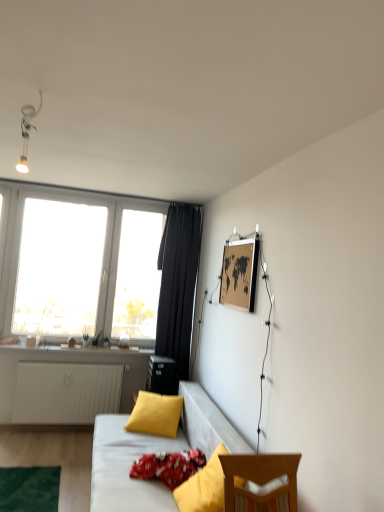
Describe the element at coordinates (153, 452) in the screenshot. This screenshot has height=512, width=384. I see `soft white fabric couch at center` at that location.

Measure the distance between wooden map at upper right and camera.

wooden map at upper right is 9.53 feet from camera.

This screenshot has width=384, height=512. Describe the element at coordinates (178, 284) in the screenshot. I see `black fabric curtain at center` at that location.

Describe the element at coordinates (204, 487) in the screenshot. The width and height of the screenshot is (384, 512). I see `yellow fabric pillow at lower right, which is the 3th pillow in back-to-front order` at that location.

Image resolution: width=384 pixels, height=512 pixels. I want to click on yellow fabric pillow at lower right, which is the 3th pillow in back-to-front order, so click(x=204, y=487).

Locate an element on the screen. The height and width of the screenshot is (512, 384). red cotton pillow at lower center, arranged as the second pillow when viewed from the back is located at coordinates (168, 466).

Where is `matte white light fixture at upper left`? The width and height of the screenshot is (384, 512). matte white light fixture at upper left is located at coordinates (27, 132).

From the picture: In order to face matte white light fixture at upper left, should I rotate leftwards or rightwards?

It's best to rotate left around 21.346 degrees.

Locate an element on the screen. The height and width of the screenshot is (512, 384). soft white fabric couch at center is located at coordinates pos(153,452).

Is matte white light fixture at upper left completely or partially inside red cotton pillow at lower center, arranged as the second pillow when viewed from the back?

No, matte white light fixture at upper left is not inside red cotton pillow at lower center, arranged as the second pillow when viewed from the back.

Could you tell me if red cotton pillow at lower center, marked as the second pillow in a front-to-back arrangement, is turned towards matte white light fixture at upper left?

No, red cotton pillow at lower center, marked as the second pillow in a front-to-back arrangement, is not turned towards matte white light fixture at upper left.

Consider the image. Between red cotton pillow at lower center, arranged as the second pillow when viewed from the back, and matte white light fixture at upper left, which one has larger size?

red cotton pillow at lower center, arranged as the second pillow when viewed from the back.

Does yellow matte pillow at center, which appears as the first pillow when viewed from the back, have a smaller size compared to yellow fabric pillow at lower right, which is the 3th pillow in back-to-front order?

Correct, yellow matte pillow at center, which appears as the first pillow when viewed from the back, occupies less space than yellow fabric pillow at lower right, which is the 3th pillow in back-to-front order.

From a real-world perspective, is yellow matte pillow at center, the 3th pillow positioned from the front, physically above yellow fabric pillow at lower right, marked as the first pillow in a front-to-back arrangement?

Incorrect, from a real-world perspective, yellow matte pillow at center, the 3th pillow positioned from the front, is lower than yellow fabric pillow at lower right, marked as the first pillow in a front-to-back arrangement.

Consider the image. From the image's perspective, is yellow matte pillow at center, the 3th pillow positioned from the front, above or below yellow fabric pillow at lower right, marked as the first pillow in a front-to-back arrangement?

Clearly, from the image's perspective, yellow matte pillow at center, the 3th pillow positioned from the front, is below yellow fabric pillow at lower right, marked as the first pillow in a front-to-back arrangement.

Who is taller, yellow matte pillow at center, the 3th pillow positioned from the front, or yellow fabric pillow at lower right, which is the 3th pillow in back-to-front order?

Standing taller between the two is yellow fabric pillow at lower right, which is the 3th pillow in back-to-front order.

Considering the positions of point (191, 312) and point (150, 463), is point (191, 312) closer or farther from the camera than point (150, 463)?

Point (191, 312) is farther from the camera than point (150, 463).

From a real-world perspective, which object rests below the other?

red cotton pillow at lower center, arranged as the second pillow when viewed from the back, is physically lower.

From the image's perspective, who appears lower, black fabric curtain at center or red cotton pillow at lower center, arranged as the second pillow when viewed from the back?

A: red cotton pillow at lower center, arranged as the second pillow when viewed from the back, from the image's perspective.

Can you confirm if black fabric curtain at center is positioned to the right of red cotton pillow at lower center, arranged as the second pillow when viewed from the back?

Yes, black fabric curtain at center is to the right of red cotton pillow at lower center, arranged as the second pillow when viewed from the back.

Is wooden map at upper right in front of or behind transparent glass window at upper left in the image?

In the image, wooden map at upper right appears in front of transparent glass window at upper left.

Is wooden map at upper right facing away from transparent glass window at upper left?

No, wooden map at upper right is not facing away from transparent glass window at upper left.

Is wooden map at upper right in contact with transparent glass window at upper left?

wooden map at upper right and transparent glass window at upper left are clearly separated.

From the image's perspective, which is above, wooden map at upper right or transparent glass window at upper left?

wooden map at upper right appears higher in the image.

Considering the relative sizes of black fabric curtain at center and soft white fabric couch at center in the image provided, is black fabric curtain at center taller than soft white fabric couch at center?

Indeed, black fabric curtain at center has a greater height compared to soft white fabric couch at center.

Find the location of `studio couch located underneath the black fabric curtain at center (from a real-world perspective)`. studio couch located underneath the black fabric curtain at center (from a real-world perspective) is located at coordinates (153, 452).

Which is behind, point (171, 234) or point (93, 502)?

Positioned behind is point (171, 234).

Is black fabric curtain at center next to soft white fabric couch at center?

black fabric curtain at center and soft white fabric couch at center are not in contact.

Based on the photo, is yellow matte pillow at center, the 3th pillow positioned from the front, outside of matte white light fixture at upper left?

yellow matte pillow at center, the 3th pillow positioned from the front, lies outside matte white light fixture at upper left's area.

Considering the positions of point (166, 424) and point (26, 161), is point (166, 424) closer or farther from the camera than point (26, 161)?

Point (166, 424) is farther from the camera than point (26, 161).

In the scene shown: Who is shorter, yellow matte pillow at center, the 3th pillow positioned from the front, or matte white light fixture at upper left?

With less height is yellow matte pillow at center, the 3th pillow positioned from the front.

Does red cotton pillow at lower center, arranged as the second pillow when viewed from the back, have a greater height compared to yellow fabric pillow at lower right, marked as the first pillow in a front-to-back arrangement?

No, red cotton pillow at lower center, arranged as the second pillow when viewed from the back, is not taller than yellow fabric pillow at lower right, marked as the first pillow in a front-to-back arrangement.

Is red cotton pillow at lower center, marked as the second pillow in a front-to-back arrangement, completely or partially outside of yellow fabric pillow at lower right, which is the 3th pillow in back-to-front order?

Yes, red cotton pillow at lower center, marked as the second pillow in a front-to-back arrangement, is located beyond the bounds of yellow fabric pillow at lower right, which is the 3th pillow in back-to-front order.

In terms of width, does red cotton pillow at lower center, arranged as the second pillow when viewed from the back, look wider or thinner when compared to yellow fabric pillow at lower right, which is the 3th pillow in back-to-front order?

Considering their sizes, red cotton pillow at lower center, arranged as the second pillow when viewed from the back, looks broader than yellow fabric pillow at lower right, which is the 3th pillow in back-to-front order.

How many degrees apart are the facing directions of red cotton pillow at lower center, arranged as the second pillow when viewed from the back, and yellow fabric pillow at lower right, marked as the first pillow in a front-to-back arrangement?

They differ by 2.17 degrees in their facing directions.

Locate an element on the screen. This screenshot has height=512, width=384. pillow that is the 2nd one when counting backward from the matte white light fixture at upper left is located at coordinates (168, 466).

Where is `the 2nd pillow in front when counting from the yellow matte pillow at center, which appears as the first pillow when viewed from the back`? the 2nd pillow in front when counting from the yellow matte pillow at center, which appears as the first pillow when viewed from the back is located at coordinates (204, 487).

When comparing their distances from matte white light fixture at upper left, does yellow matte pillow at center, which appears as the first pillow when viewed from the back, or transparent glass window at upper left seem closer?

transparent glass window at upper left is positioned closer to the anchor matte white light fixture at upper left.

From the image, which object appears to be farther from black fabric curtain at center, wooden map at upper right or matte white light fixture at upper left?

The object further to black fabric curtain at center is matte white light fixture at upper left.

Considering their positions, is wooden map at upper right positioned further to black fabric curtain at center than soft white fabric couch at center?

Among the two, soft white fabric couch at center is located further to black fabric curtain at center.

When comparing their distances from soft white fabric couch at center, does wooden map at upper right or yellow fabric pillow at lower right, which is the 3th pillow in back-to-front order, seem closer?

Based on the image, yellow fabric pillow at lower right, which is the 3th pillow in back-to-front order, appears to be nearer to soft white fabric couch at center.

From the image, which object appears to be nearer to matte white light fixture at upper left, black fabric curtain at center or red cotton pillow at lower center, marked as the second pillow in a front-to-back arrangement?

red cotton pillow at lower center, marked as the second pillow in a front-to-back arrangement.

From the image, which object appears to be nearer to black fabric curtain at center, red cotton pillow at lower center, arranged as the second pillow when viewed from the back, or soft white fabric couch at center?

soft white fabric couch at center.

Considering their positions, is yellow fabric pillow at lower right, which is the 3th pillow in back-to-front order, positioned closer to wooden map at upper right than matte white light fixture at upper left?

The object closer to wooden map at upper right is yellow fabric pillow at lower right, which is the 3th pillow in back-to-front order.

When comparing their distances from yellow matte pillow at center, the 3th pillow positioned from the front, does yellow fabric pillow at lower right, marked as the first pillow in a front-to-back arrangement, or transparent glass window at upper left seem closer?

yellow fabric pillow at lower right, marked as the first pillow in a front-to-back arrangement, is closer to yellow matte pillow at center, the 3th pillow positioned from the front.

Identify the location of picture frame located between matte white light fixture at upper left and black fabric curtain at center in the depth direction. (239, 274).

Identify the location of window between matte white light fixture at upper left and black fabric curtain at center in the front-back direction. The width and height of the screenshot is (384, 512). (81, 265).

Where is `picture frame between soft white fabric couch at center and black fabric curtain at center along the z-axis`? This screenshot has height=512, width=384. picture frame between soft white fabric couch at center and black fabric curtain at center along the z-axis is located at coordinates (239, 274).

Locate an element on the screen. window positioned between yellow fabric pillow at lower right, which is the 3th pillow in back-to-front order, and black fabric curtain at center from near to far is located at coordinates (81, 265).